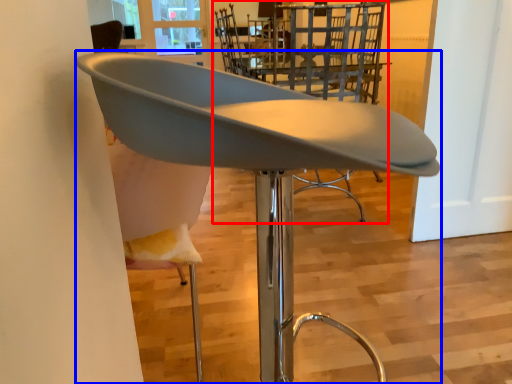
Question: Which object is further to the camera taking this photo, chair (highlighted by a red box) or chair (highlighted by a blue box)?

Choices:
 (A) chair
 (B) chair

Answer: (A)